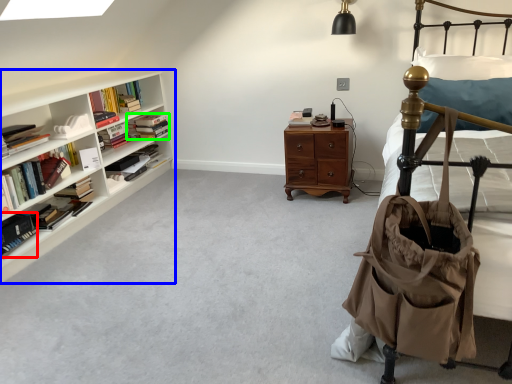
Question: Which is nearer to the book (highlighted by a red box)? shelf (highlighted by a blue box) or book (highlighted by a green box).

Choices:
 (A) shelf
 (B) book

Answer: (A)